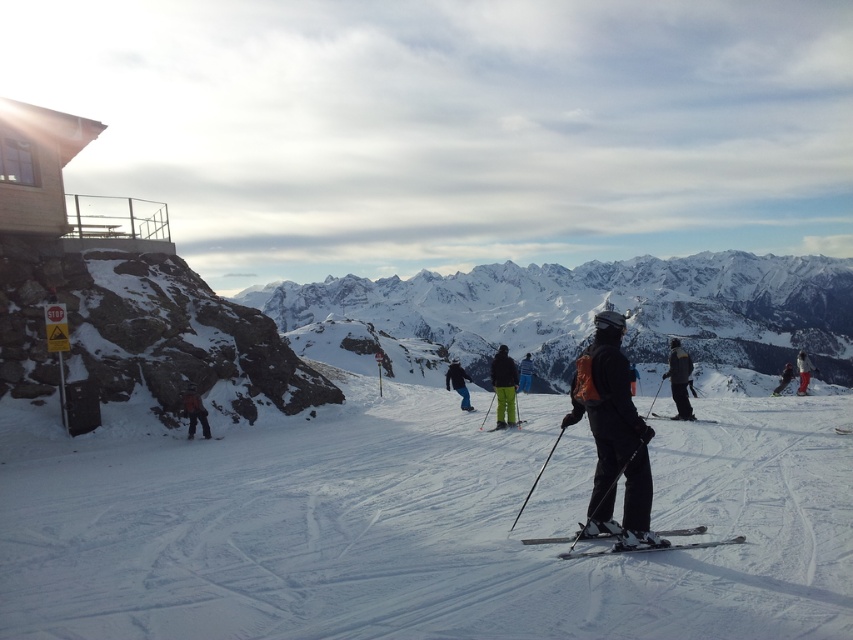
Is shiny black skis at center positioned in front of matte black jacket at center?

That is True.

Which is above, shiny black skis at center or matte black jacket at center?

matte black jacket at center

Who is more distant from viewer, (x=692, y=529) or (x=508, y=384)?

Point (x=508, y=384)

I want to click on shiny black skis at center, so click(651, 544).

Is point (479, 298) farther from viewer compared to point (206, 413)?

Yes, point (479, 298) is behind point (206, 413).

This screenshot has width=853, height=640. Describe the element at coordinates (601, 307) in the screenshot. I see `snowy granite mountains at center` at that location.

Image resolution: width=853 pixels, height=640 pixels. What are the coordinates of `snowy granite mountains at center` in the screenshot? It's located at (601, 307).

Between point (498, 372) and point (195, 419), which one is positioned behind?

Point (498, 372)

Can you confirm if matte black jacket at center is smaller than matte black jacket at lower left?

Incorrect, matte black jacket at center is not smaller in size than matte black jacket at lower left.

Between point (506, 404) and point (207, 428), which one is positioned in front?

Point (207, 428)

Locate an element on the screen. matte black jacket at center is located at coordinates (503, 387).